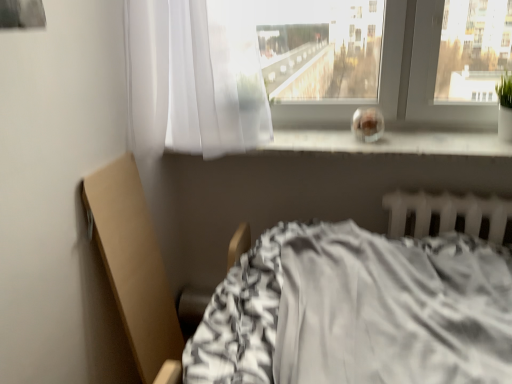
Question: Can you confirm if white plastic radiator at lower right is positioned to the right of transparent glass at center?

Choices:
 (A) no
 (B) yes

Answer: (B)

Question: Considering the relative positions of white plastic radiator at lower right and transparent glass at center in the image provided, is white plastic radiator at lower right behind transparent glass at center?

Choices:
 (A) yes
 (B) no

Answer: (A)

Question: Is white plastic radiator at lower right not within transparent glass at center?

Choices:
 (A) yes
 (B) no

Answer: (A)

Question: Is white plastic radiator at lower right not close to transparent glass at center?

Choices:
 (A) no
 (B) yes

Answer: (A)

Question: Considering the relative positions of white plastic radiator at lower right and transparent glass at center in the image provided, is white plastic radiator at lower right to the left of transparent glass at center from the viewer's perspective?

Choices:
 (A) no
 (B) yes

Answer: (A)

Question: Which is correct: sheer white curtain at upper center is inside transparent glass at center, or outside of it?

Choices:
 (A) inside
 (B) outside

Answer: (B)

Question: Considering their positions, is sheer white curtain at upper center located in front of or behind transparent glass at center?

Choices:
 (A) front
 (B) behind

Answer: (A)

Question: Considering the positions of sheer white curtain at upper center and transparent glass at center in the image, is sheer white curtain at upper center wider or thinner than transparent glass at center?

Choices:
 (A) thin
 (B) wide

Answer: (B)

Question: From a real-world perspective, relative to transparent glass at center, is sheer white curtain at upper center vertically above or below?

Choices:
 (A) below
 (B) above

Answer: (B)

Question: Considering their positions, is transparent glass at center located in front of or behind sheer white curtain at upper center?

Choices:
 (A) front
 (B) behind

Answer: (B)

Question: Is transparent glass at center bigger or smaller than sheer white curtain at upper center?

Choices:
 (A) small
 (B) big

Answer: (A)

Question: From a real-world perspective, is transparent glass at center positioned above or below sheer white curtain at upper center?

Choices:
 (A) above
 (B) below

Answer: (B)

Question: Is point (480, 132) closer or farther from the camera than point (187, 147)?

Choices:
 (A) farther
 (B) closer

Answer: (A)

Question: Relative to transparent glass at center, is white plastic radiator at lower right in front or behind?

Choices:
 (A) behind
 (B) front

Answer: (A)

Question: From a real-world perspective, is white plastic radiator at lower right above or below transparent glass at center?

Choices:
 (A) above
 (B) below

Answer: (B)